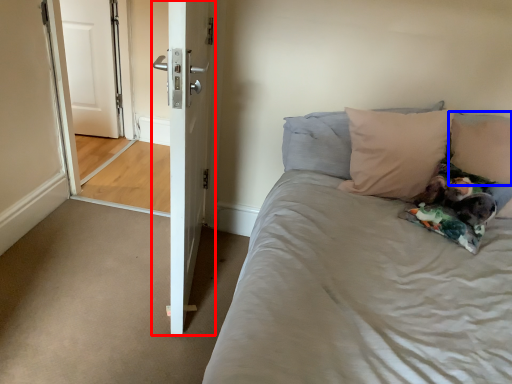
Question: Which of the following is the closest to the observer, door (highlighted by a red box) or pillow (highlighted by a blue box)?

Choices:
 (A) door
 (B) pillow

Answer: (A)